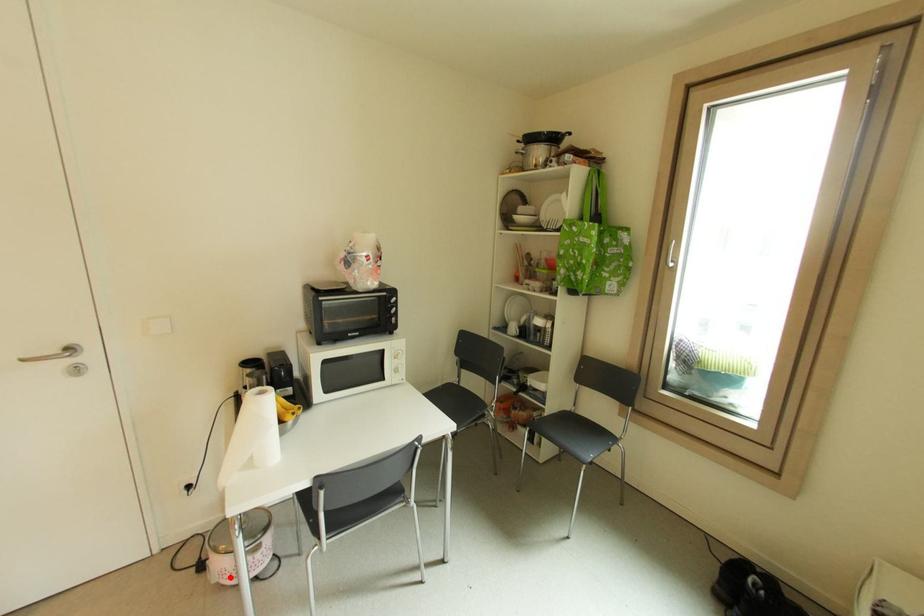
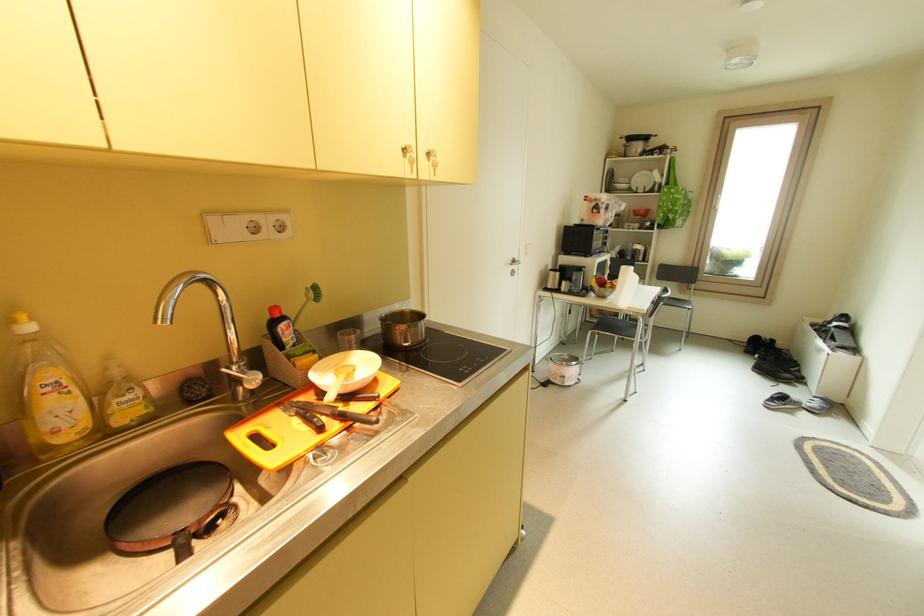
The point at the highlighted location is marked in the first image. Where is the corresponding point in the second image?

(578, 379)